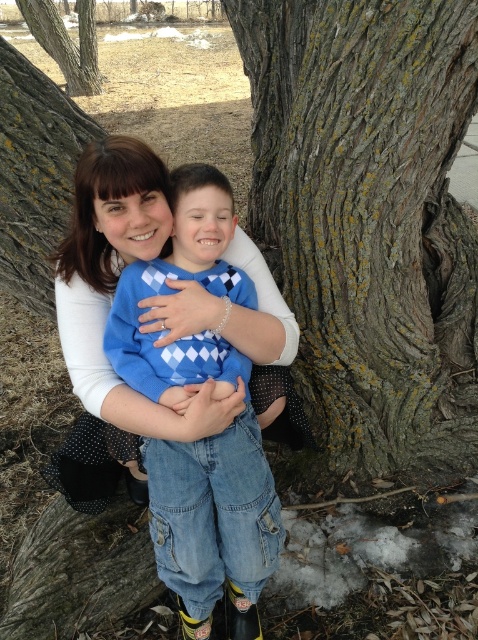
You are a photographer trying to capture a photo of the blue argyle sweater at center and the rough bark tree at upper left. The camera you are using has a maximum focus range of 10 meters. Will both subjects be in focus?

The blue argyle sweater at center is 11.36 meters away from the rough bark tree at upper left. Since the camera can only focus up to 10 meters, the distance between them exceeds the maximum focus range. Therefore, both subjects cannot be in focus simultaneously.

You are a photographer trying to capture both the rough bark tree at center and the rough bark tree at upper left in a single shot. Which tree should you position closer to the left edge of your camera frame to ensure both are visible?

You should position the rough bark tree at upper left closer to the left edge of your camera frame because the rough bark tree at center is positioned on the right side of it.